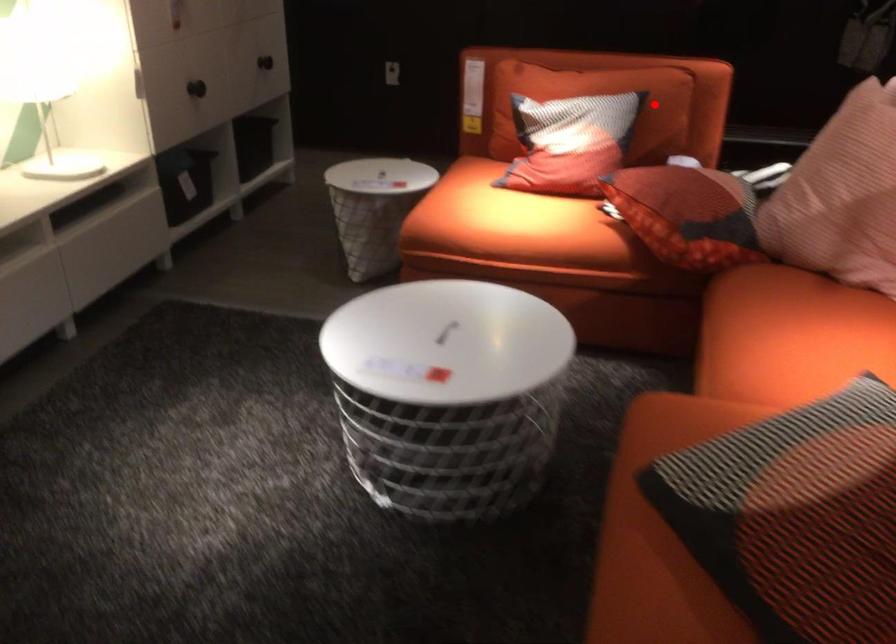
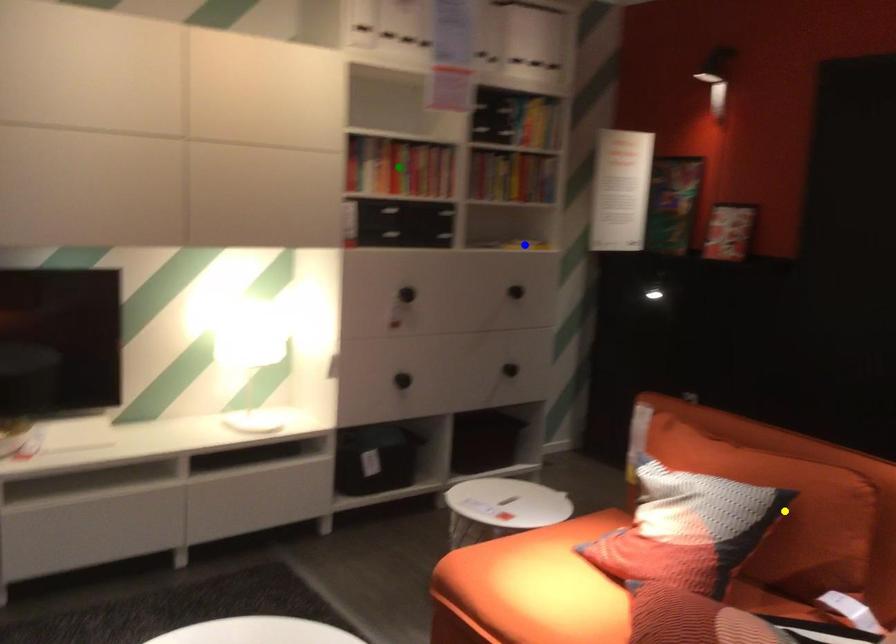
Question: I am providing you with two images of the same scene from different viewpoints. A red point is marked on the first image. You are given multiple points on the second image. In image 2, which mark is for the same physical point as the one in image 1?

Choices:
 (A) yellow point
 (B) blue point
 (C) green point

Answer: (A)